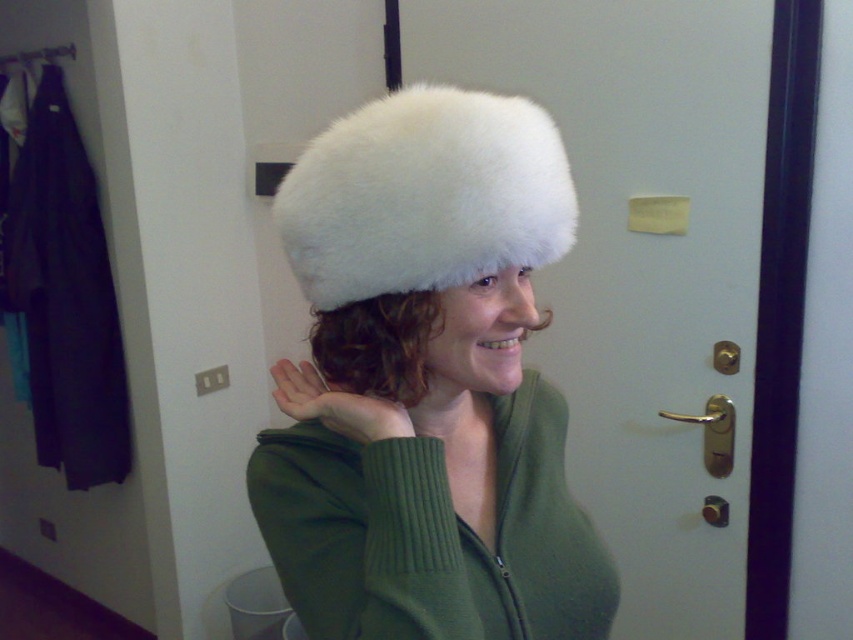
Consider the image. You are a photographer adjusting your camera settings. You notice the white furry hat at center and the white fluffy hat at center in the scene. Since you want to focus on one hat, which one should you choose to ensure the other remains in the background due to their distance apart?

The distance between the white furry hat at center and the white fluffy hat at center is 4.20 inches. To have one hat in focus and the other in the background, you should choose to focus on either hat since the distance between them is sufficient for depth of field effects, but the exact choice depends on desired composition.

You are a photographer trying to capture the white furry hat at center in the image. The camera has a focus point at coordinate 0.600, 0.502. Will the hat be in focus?

Yes, the white furry hat at center is located at point (427, 384), so the camera focus point is exactly at the hat, ensuring it will be in focus.

Based on the photo, you are trying to decide which hat to wear for an outdoor event. You have the white furry hat at center and the white fluffy hat at center. Which one is bigger?

The white furry hat at center is larger than the white fluffy hat at center.